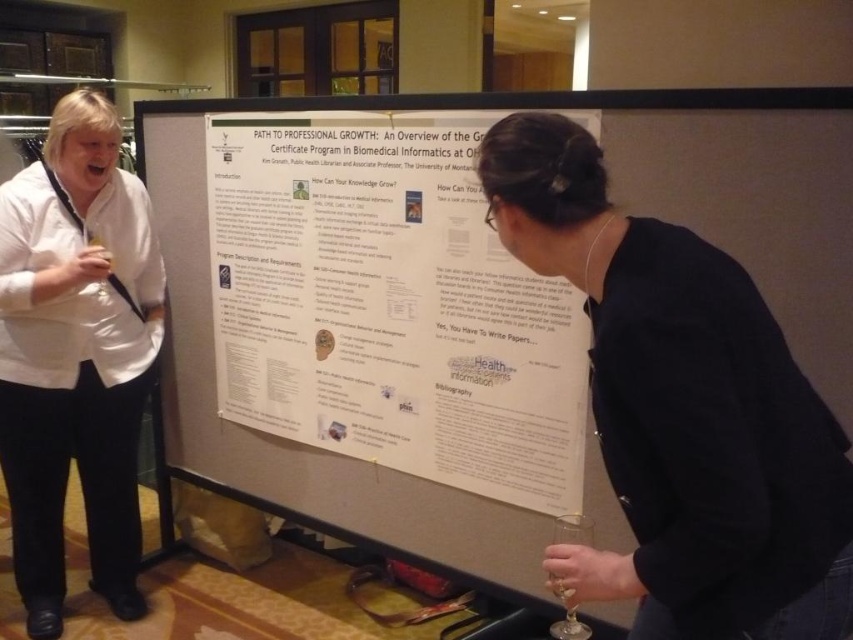
Question: Considering the real-world distances, which object is farthest from the white shirt at left?

Choices:
 (A) transparent glass at upper left
 (B) white paper poster at center
 (C) clear glass wine glass at lower center

Answer: (C)

Question: Can you confirm if clear glass wine glass at lower center is wider than transparent glass at upper left?

Choices:
 (A) no
 (B) yes

Answer: (B)

Question: Does white shirt at left appear on the left side of transparent glass at upper left?

Choices:
 (A) yes
 (B) no

Answer: (A)

Question: Which point is closer to the camera?

Choices:
 (A) black matte poster at center
 (B) transparent glass at upper left

Answer: (A)

Question: Which object is positioned closest to the white paper poster at center?

Choices:
 (A) transparent glass at upper left
 (B) clear glass wine glass at lower center

Answer: (A)

Question: Is white paper poster at center closer to camera compared to transparent glass at upper left?

Choices:
 (A) no
 (B) yes

Answer: (B)